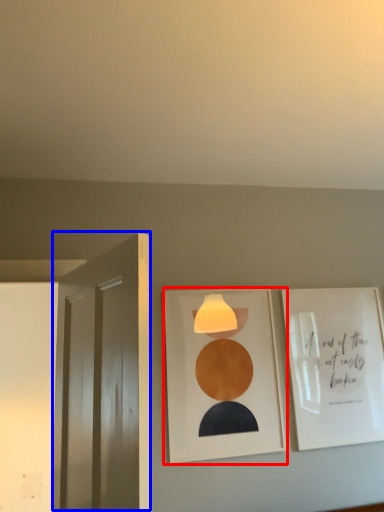
Question: Which of the following is the farthest to the observer, picture frame (highlighted by a red box) or door (highlighted by a blue box)?

Choices:
 (A) picture frame
 (B) door

Answer: (A)